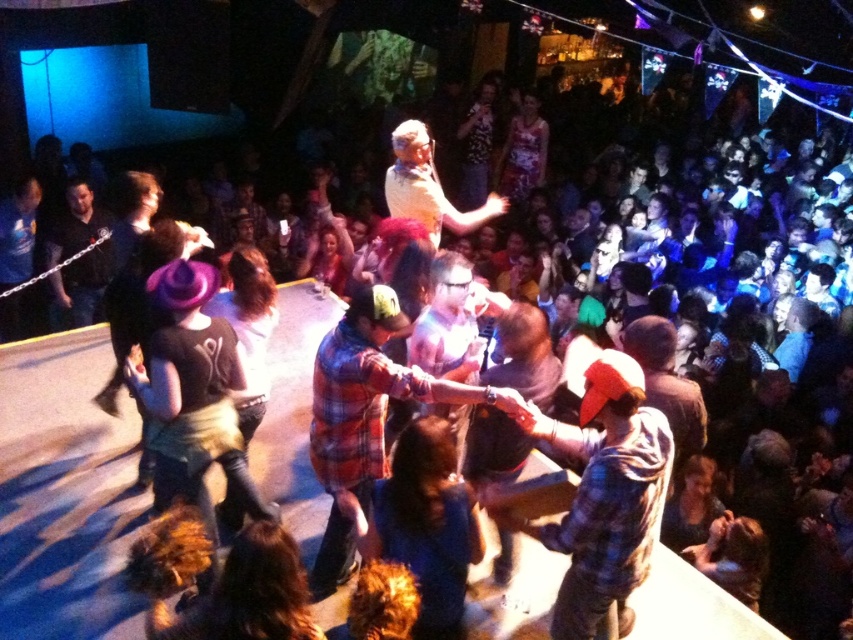
Between point (320, 563) and point (48, 259), which one is positioned in front?

Point (320, 563) is more forward.

Is the position of plaid shirt at center more distant than that of matte black shirt at left?

No, it is not.

Who is more distant from viewer, (357, 332) or (102, 253)?

Positioned behind is point (102, 253).

Locate an element on the screen. plaid shirt at center is located at coordinates (364, 416).

Does plaid flannel shirt at center have a larger size compared to matte black shirt at left?

Yes.

Does point (581, 577) come in front of point (106, 260)?

Yes.

Measure the distance between point [624,449] and camera.

They are 2.52 meters apart.

You are a GUI agent. You are given a task and a screenshot of the screen. Output one action in this format:
    pyautogui.click(x=<x>, y=<y>)
    Task: Click on the plaid flannel shirt at center
    
    Given the screenshot: What is the action you would take?
    pyautogui.click(x=604, y=497)

Based on the photo, is plaid flannel shirt at center shorter than plaid shirt at center?

Yes.

Who is higher up, plaid flannel shirt at center or plaid shirt at center?

plaid shirt at center

Is point (612, 390) positioned before point (341, 408)?

Yes, it is.

At what (x,y) coordinates should I click in order to perform the action: click on plaid flannel shirt at center. Please return your answer as a coordinate pair (x, y). Looking at the image, I should click on (604, 497).